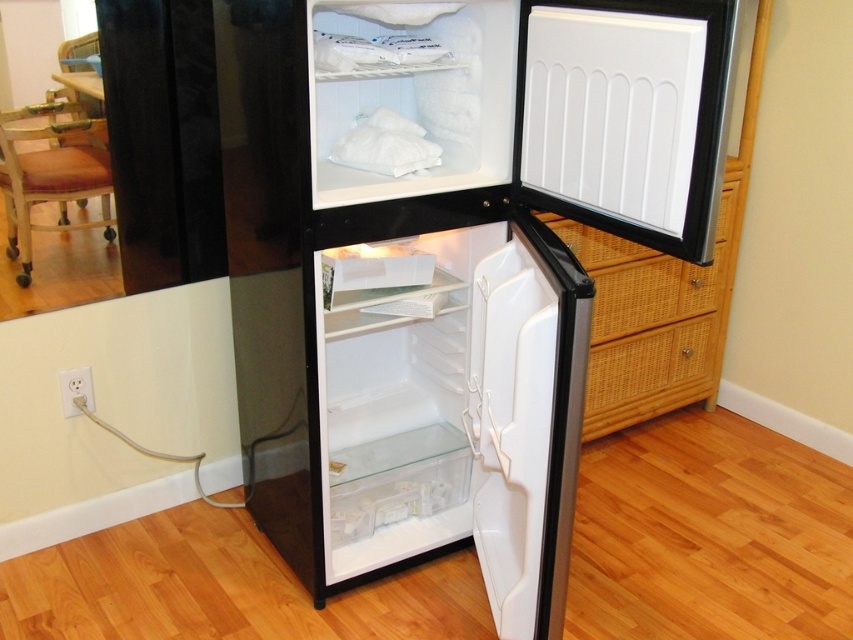
Question: Among these points, which one is nearest to the camera?

Choices:
 (A) (512, 493)
 (B) (605, 113)

Answer: (B)

Question: Which point is closer to the camera?

Choices:
 (A) black glossy refrigerator at center
 (B) white matte door at center

Answer: (A)

Question: Can you confirm if black glossy refrigerator at center is thinner than white matte door at center?

Choices:
 (A) no
 (B) yes

Answer: (A)

Question: Can you confirm if black glossy refrigerator at center is wider than white matte door at center?

Choices:
 (A) no
 (B) yes

Answer: (B)

Question: Is black glossy refrigerator at center closer to camera compared to white matte door at center?

Choices:
 (A) yes
 (B) no

Answer: (A)